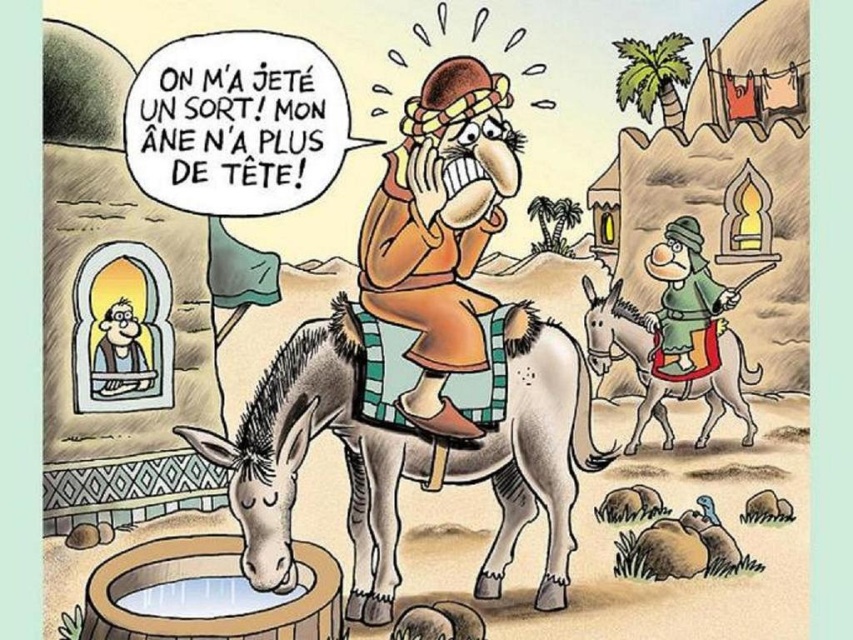
Which is below, brown leather hat at upper center or green fabric hat at upper right?

green fabric hat at upper right is lower down.

Which of these two, brown leather hat at upper center or green fabric hat at upper right, stands shorter?

green fabric hat at upper right

Which is behind, point (431, 195) or point (657, 244)?

Positioned behind is point (657, 244).

Where is `brown leather hat at upper center`? brown leather hat at upper center is located at coordinates (440, 234).

Which is below, light blue paper scroll at upper left or smooth brown shirt at upper left?

smooth brown shirt at upper left is lower down.

Does light blue paper scroll at upper left have a greater width compared to smooth brown shirt at upper left?

Yes, light blue paper scroll at upper left is wider than smooth brown shirt at upper left.

Is point (160, 330) more distant than point (137, 349)?

Yes, it is behind point (137, 349).

Locate an element on the screen. The image size is (853, 640). light blue paper scroll at upper left is located at coordinates (122, 330).

Can you confirm if brown leather hat at upper center is bigger than green felt hat at upper right?

Yes, brown leather hat at upper center is bigger than green felt hat at upper right.

From the picture: Is brown leather hat at upper center to the right of green felt hat at upper right from the viewer's perspective?

Incorrect, brown leather hat at upper center is not on the right side of green felt hat at upper right.

Who is more distant from viewer, [363,237] or [598,342]?

Positioned behind is point [598,342].

Where is `brown leather hat at upper center`? The height and width of the screenshot is (640, 853). brown leather hat at upper center is located at coordinates (440, 234).